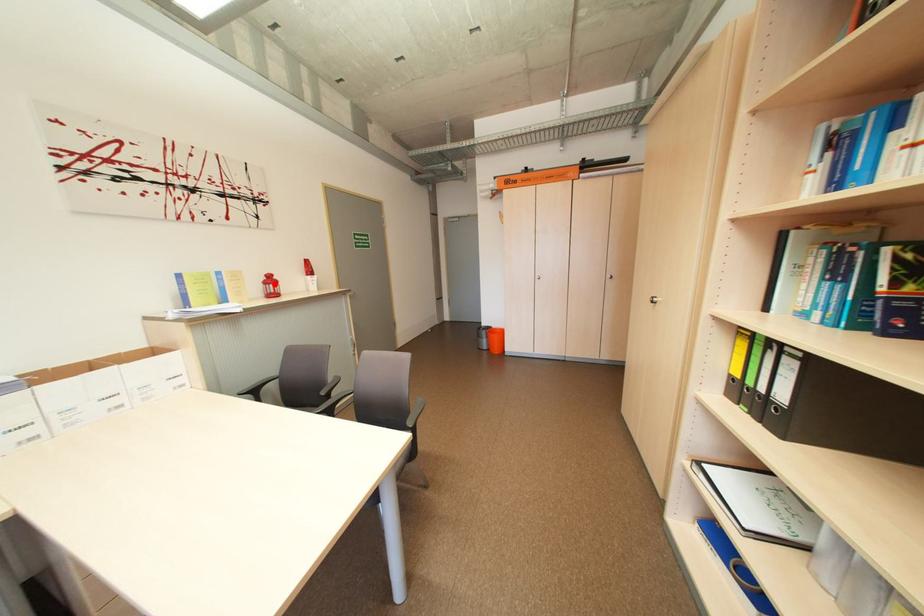
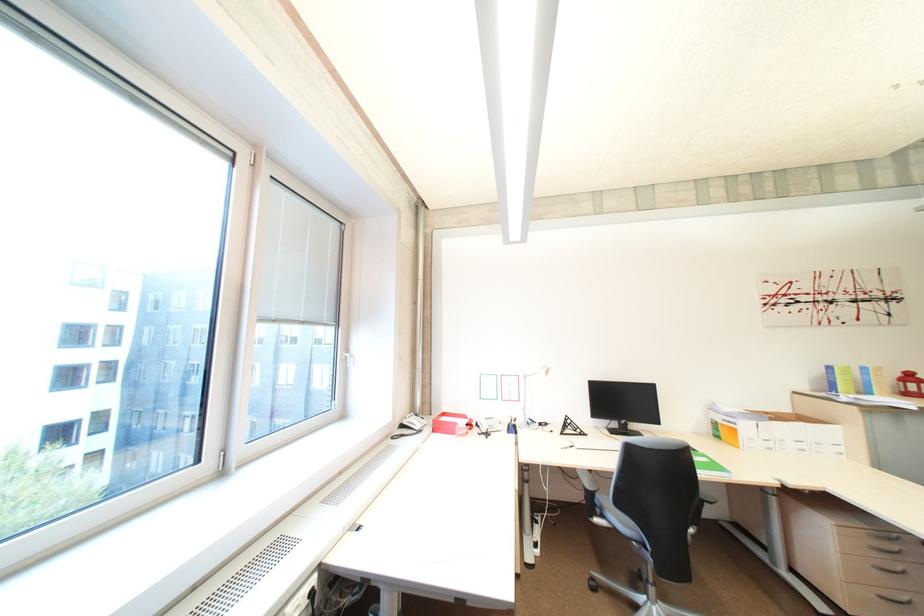
In the second image, find the point that corresponds to the highlighted location in the first image.

(913, 382)